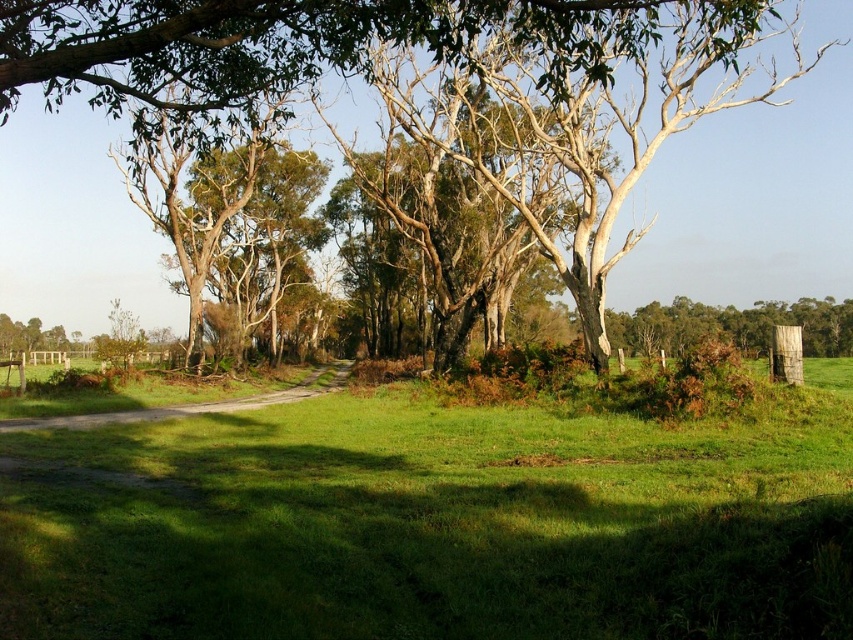
Question: Which point is farther to the camera?

Choices:
 (A) (10, 246)
 (B) (28, 419)
 (C) (659, 422)

Answer: (A)

Question: Is green grass at center to the left of dirt road at center from the viewer's perspective?

Choices:
 (A) yes
 (B) no

Answer: (B)

Question: Which point is farther to the camera?

Choices:
 (A) green leafy tree at center
 (B) dirt road at center
 (C) green grass at center

Answer: (A)

Question: Considering the relative positions of green grass at center and dirt road at center in the image provided, where is green grass at center located with respect to dirt road at center?

Choices:
 (A) left
 (B) right

Answer: (B)

Question: Is green grass at center to the right of dirt road at center from the viewer's perspective?

Choices:
 (A) no
 (B) yes

Answer: (B)

Question: Which object is positioned farthest from the dirt road at center?

Choices:
 (A) green grass at center
 (B) green leafy tree at center

Answer: (B)